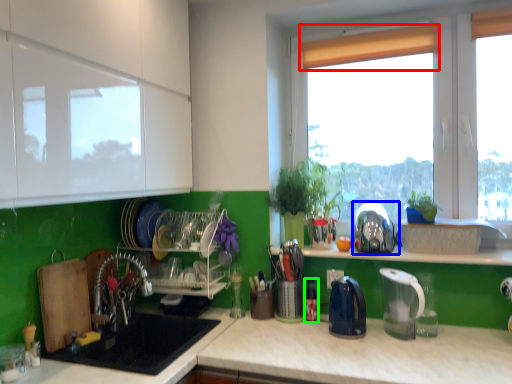
Question: Based on their relative distances, which object is farther from curtain (highlighted by a red box)? Choose from appliance (highlighted by a blue box) and bottle (highlighted by a green box).

Choices:
 (A) appliance
 (B) bottle

Answer: (B)